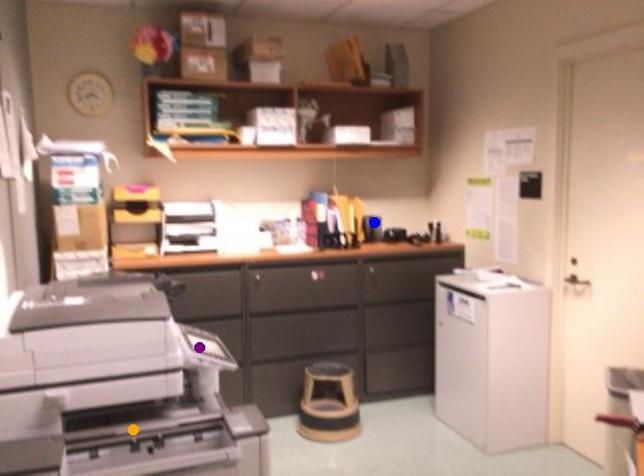
Order these from farthest to nearest:
1. purple point
2. orange point
3. blue point

blue point → purple point → orange point